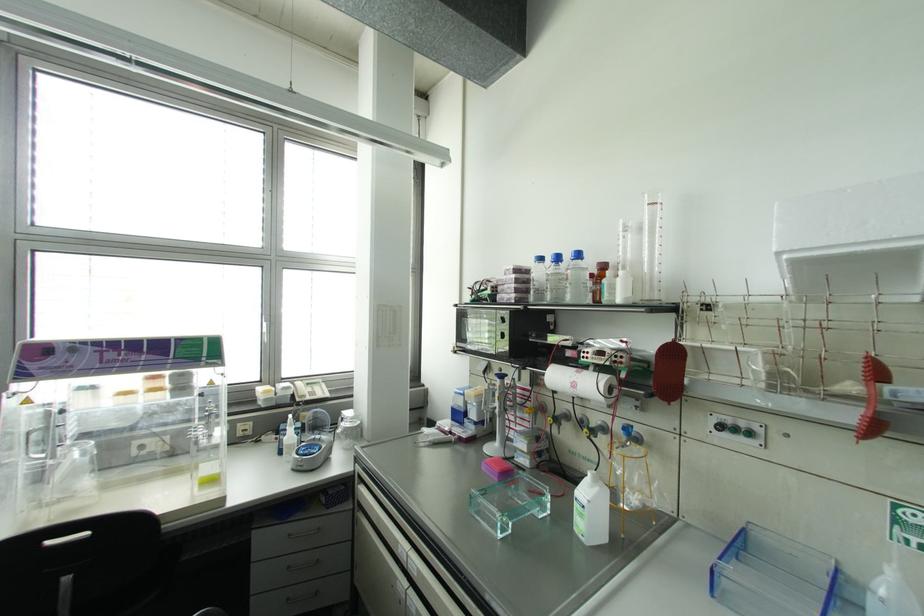
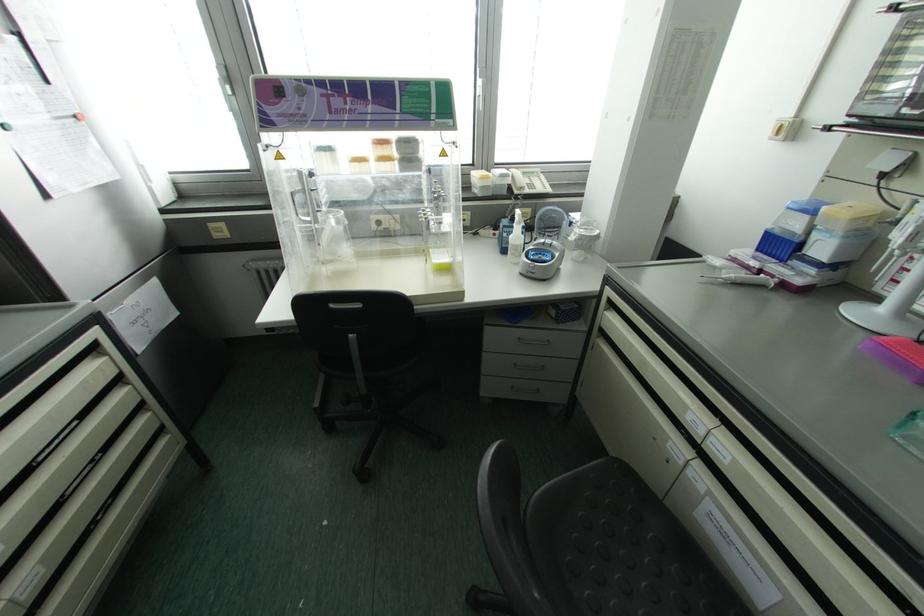
Find the pixel in the second image that matches pixel 289 436 in the first image.

(516, 235)